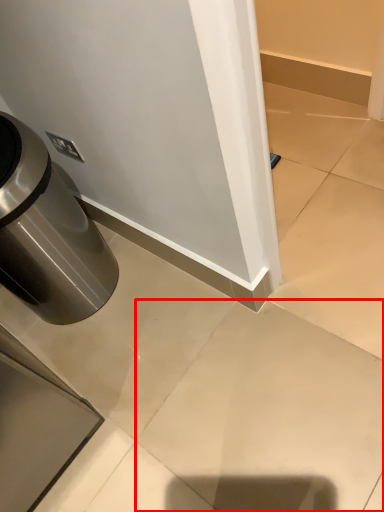
Question: In this image, where is concrete (annotated by the red box) located relative to waste container?

Choices:
 (A) right
 (B) left

Answer: (A)